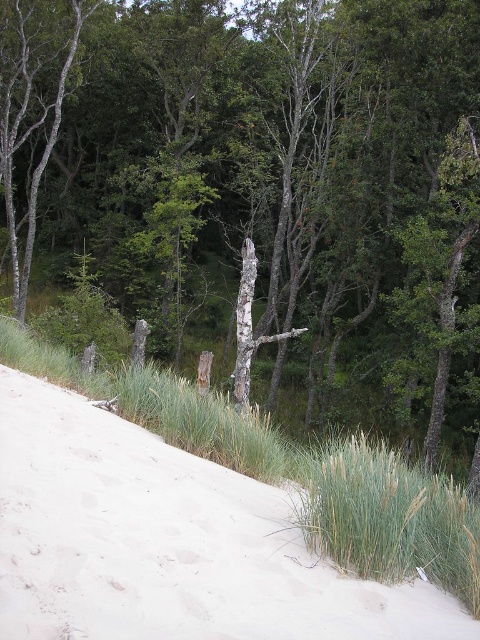
Question: Is green grass at lower left thinner than gray bark tree trunk at center?

Choices:
 (A) yes
 (B) no

Answer: (B)

Question: Is green grass at lower left further to camera compared to gray bark tree trunk at center?

Choices:
 (A) yes
 (B) no

Answer: (B)

Question: Which point is farther from the camera taking this photo?

Choices:
 (A) (247, 380)
 (B) (145, 392)

Answer: (A)

Question: Can you confirm if green grass at lower left is wider than gray bark tree trunk at center?

Choices:
 (A) yes
 (B) no

Answer: (A)